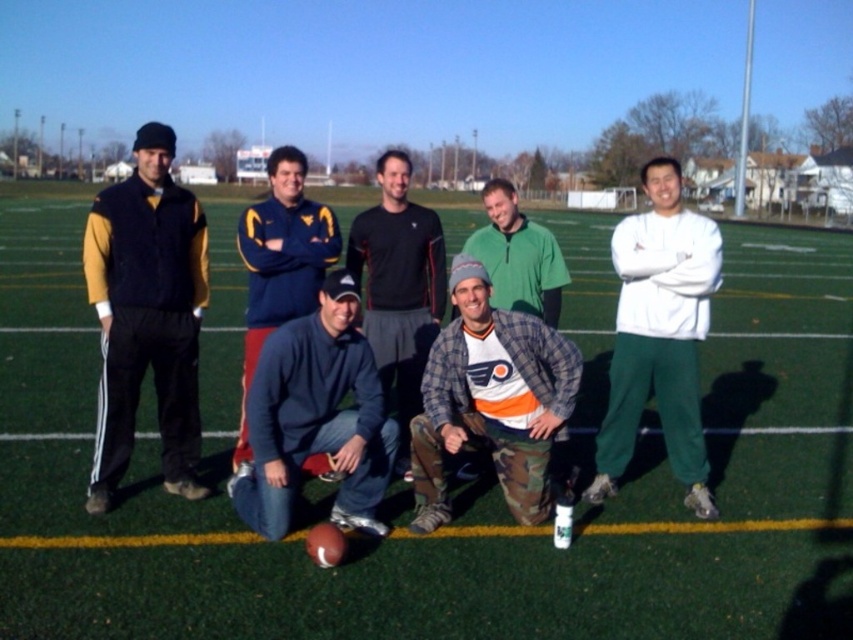
Is camo pants at center positioned before blue fleece at center?

No, it is behind blue fleece at center.

Can you confirm if camo pants at center is thinner than blue fleece at center?

Indeed, camo pants at center has a lesser width compared to blue fleece at center.

Does point (567, 353) come behind point (281, 528)?

Yes, point (567, 353) is farther from viewer.

Image resolution: width=853 pixels, height=640 pixels. Find the location of `camo pants at center`. camo pants at center is located at coordinates (491, 401).

Is point (173, 428) more distant than point (546, 248)?

That is False.

Measure the distance from matte black vest at left to green fleece jacket at center.

The distance of matte black vest at left from green fleece jacket at center is 10.46 feet.

At what (x,y) coordinates should I click in order to perform the action: click on matte black vest at left. Please return your answer as a coordinate pair (x, y). This screenshot has width=853, height=640. Looking at the image, I should click on (146, 314).

Image resolution: width=853 pixels, height=640 pixels. In order to click on matte black vest at left in this screenshot , I will do `click(146, 314)`.

Is camouflage pants at center below blue fleece at center?

No, camouflage pants at center is not below blue fleece at center.

Does camouflage pants at center lie in front of blue fleece at center?

No, camouflage pants at center is further to the viewer.

This screenshot has width=853, height=640. Find the location of `camouflage pants at center`. camouflage pants at center is located at coordinates (659, 330).

At what (x,y) coordinates should I click in order to perform the action: click on camouflage pants at center. Please return your answer as a coordinate pair (x, y). This screenshot has width=853, height=640. Looking at the image, I should click on (659, 330).